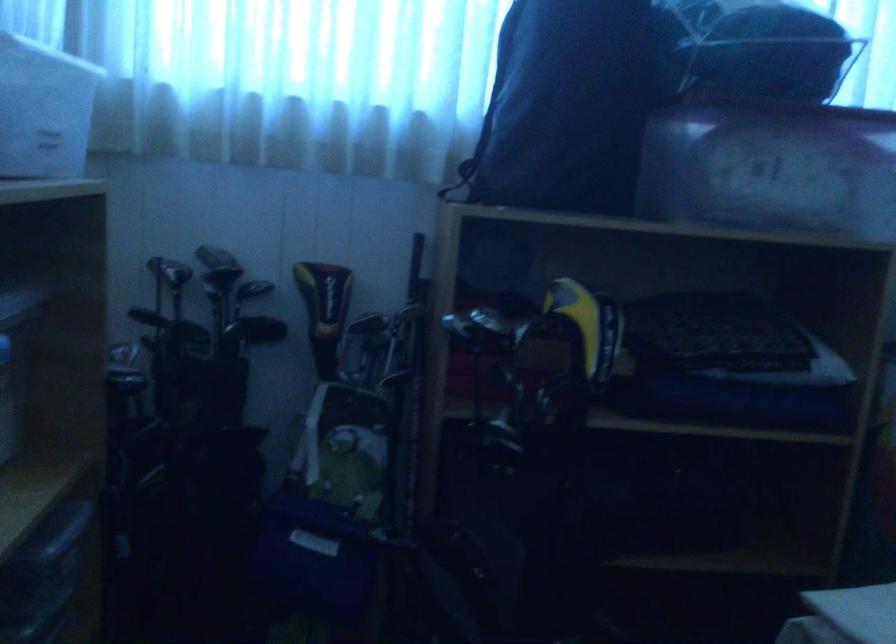
Find where to pull the yellow club headcover. Please return your answer as a coordinate pair (x, y).

(590, 325)